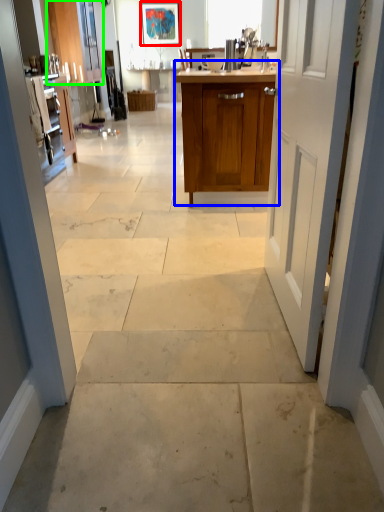
Question: Which object is the closest to the picture frame (highlighted by a red box)? Choose among these: cabinetry (highlighted by a blue box) or cabinetry (highlighted by a green box).

Choices:
 (A) cabinetry
 (B) cabinetry

Answer: (B)